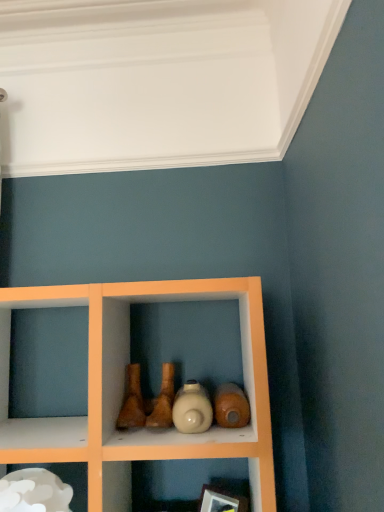
Question: Considering the relative positions of wooden picture frame at lower center and white glossy cloud at lower left in the image provided, is wooden picture frame at lower center behind white glossy cloud at lower left?

Choices:
 (A) yes
 (B) no

Answer: (A)

Question: Is wooden picture frame at lower center completely or partially outside of white glossy cloud at lower left?

Choices:
 (A) yes
 (B) no

Answer: (A)

Question: Is wooden picture frame at lower center to the left of white glossy cloud at lower left from the viewer's perspective?

Choices:
 (A) yes
 (B) no

Answer: (B)

Question: From a real-world perspective, does wooden picture frame at lower center sit lower than white glossy cloud at lower left?

Choices:
 (A) no
 (B) yes

Answer: (B)

Question: From the image's perspective, is wooden picture frame at lower center below white glossy cloud at lower left?

Choices:
 (A) yes
 (B) no

Answer: (A)

Question: Considering the relative sizes of wooden picture frame at lower center and white glossy cloud at lower left in the image provided, is wooden picture frame at lower center shorter than white glossy cloud at lower left?

Choices:
 (A) no
 (B) yes

Answer: (A)

Question: Is white glossy cloud at lower left oriented away from wooden picture frame at lower center?

Choices:
 (A) yes
 (B) no

Answer: (B)

Question: Is white glossy cloud at lower left not near wooden picture frame at lower center?

Choices:
 (A) yes
 (B) no

Answer: (B)

Question: From a real-world perspective, does white glossy cloud at lower left stand above wooden picture frame at lower center?

Choices:
 (A) no
 (B) yes

Answer: (B)

Question: Is white glossy cloud at lower left outside wooden picture frame at lower center?

Choices:
 (A) no
 (B) yes

Answer: (B)

Question: Is the position of white glossy cloud at lower left less distant than that of wooden picture frame at lower center?

Choices:
 (A) no
 (B) yes

Answer: (B)

Question: Is white glossy cloud at lower left smaller than wooden picture frame at lower center?

Choices:
 (A) yes
 (B) no

Answer: (B)

Question: Could matte beige bottle at center be considered to be inside wooden picture frame at lower center?

Choices:
 (A) no
 (B) yes

Answer: (A)